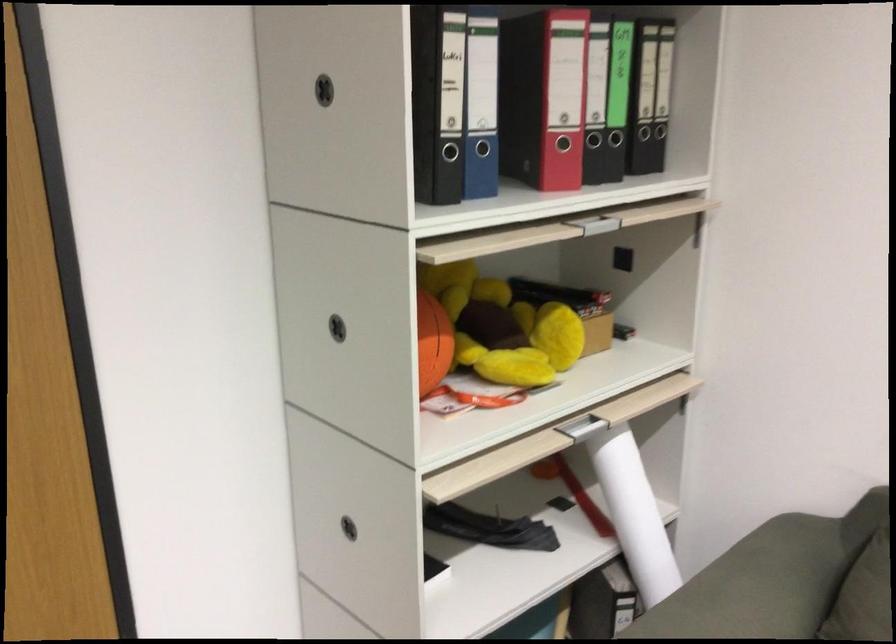
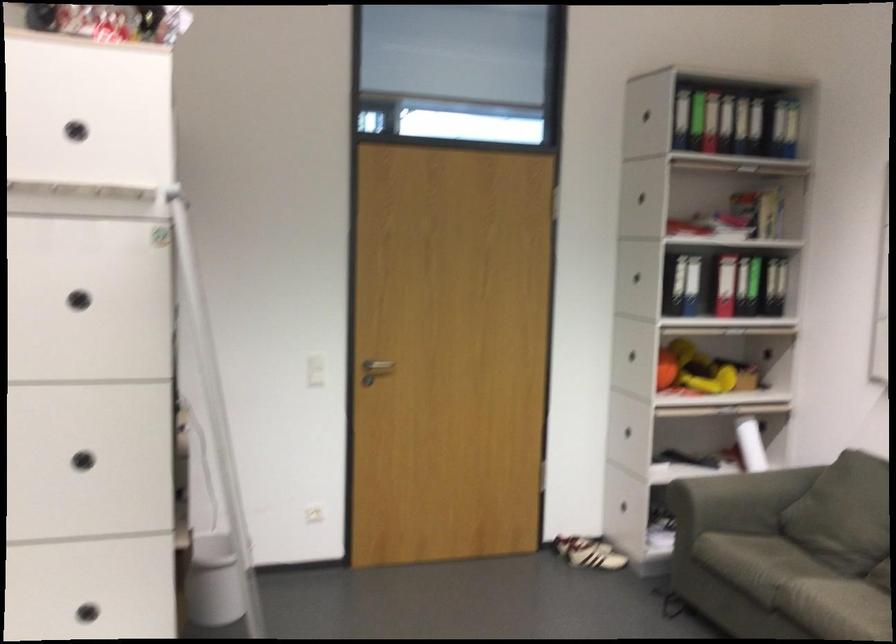
Locate, in the second image, the point that corresponds to [659,131] in the first image.

(773, 286)